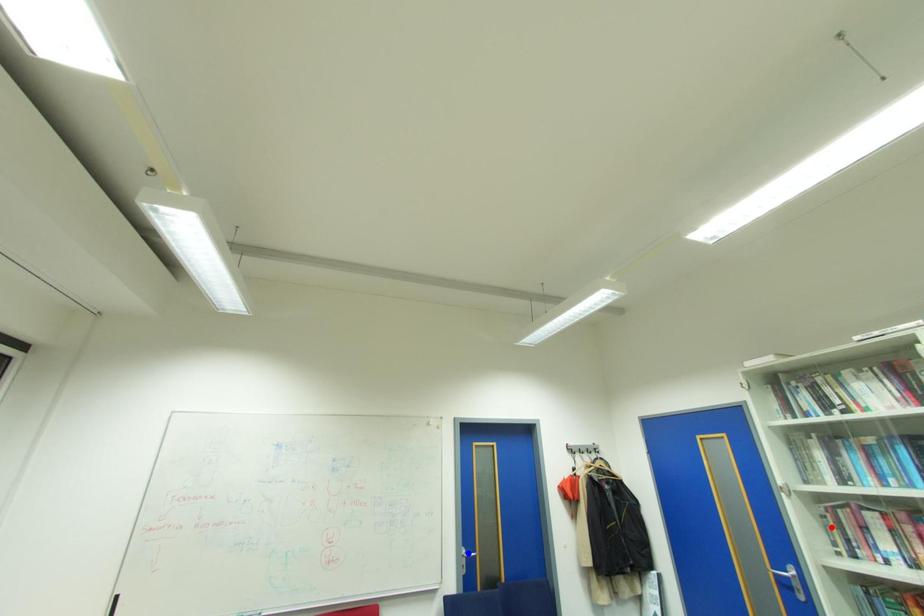
Question: In the image, two points are highlighted. Which point is nearer to the camera? Reply with the corresponding letter.

Choices:
 (A) blue point
 (B) red point

Answer: (B)